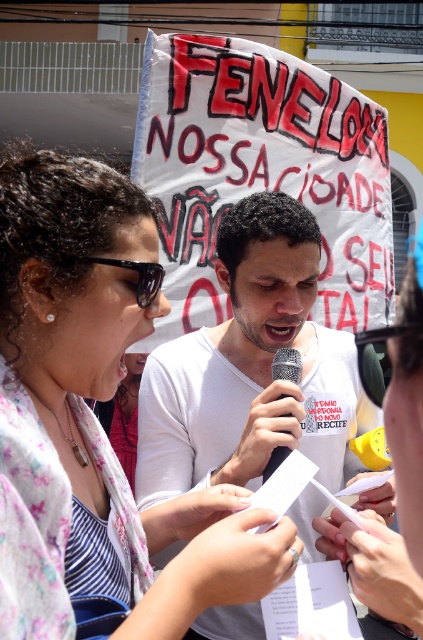
Question: Which point is farther to the camera?

Choices:
 (A) (128, 628)
 (B) (304, 426)
 (C) (293, 365)

Answer: (B)

Question: Does matte white scarf at upper left have a smaller size compared to black plastic sunglasses at left?

Choices:
 (A) yes
 (B) no

Answer: (B)

Question: Does matte white scarf at upper left have a larger size compared to metallic silver microphone at center?

Choices:
 (A) yes
 (B) no

Answer: (A)

Question: Which point appears farthest from the camera in this image?

Choices:
 (A) (147, 401)
 (B) (274, 378)
 (C) (162, 272)
 (D) (84, 368)

Answer: (A)

Question: Considering the real-world distances, which object is farthest from the white matte shirt at center?

Choices:
 (A) metallic silver microphone at center
 (B) black plastic sunglasses at left
 (C) matte white scarf at upper left

Answer: (B)

Question: Is the position of matte white scarf at upper left less distant than that of metallic silver microphone at center?

Choices:
 (A) yes
 (B) no

Answer: (A)